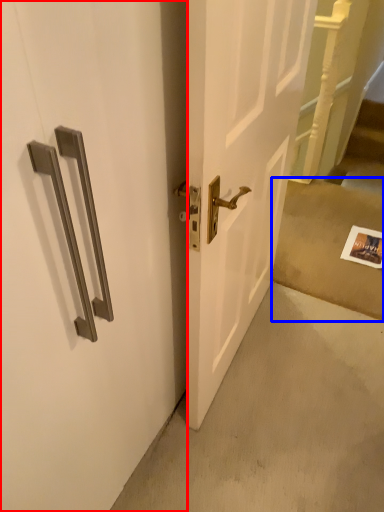
Question: Which object is further to the camera taking this photo, door (highlighted by a red box) or concrete (highlighted by a blue box)?

Choices:
 (A) door
 (B) concrete

Answer: (B)